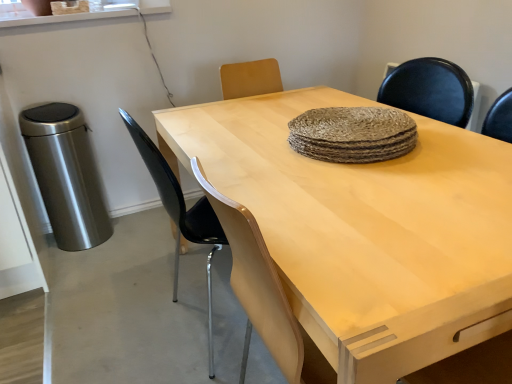
Question: From a real-world perspective, is black plastic chair at center located beneath light wood table at center?

Choices:
 (A) yes
 (B) no

Answer: (B)

Question: Is black plastic chair at center bigger than light wood table at center?

Choices:
 (A) no
 (B) yes

Answer: (A)

Question: Is black plastic chair at center oriented towards light wood table at center?

Choices:
 (A) yes
 (B) no

Answer: (A)

Question: Is black plastic chair at center at the right side of light wood table at center?

Choices:
 (A) no
 (B) yes

Answer: (A)

Question: From a real-world perspective, is black plastic chair at center on light wood table at center?

Choices:
 (A) no
 (B) yes

Answer: (B)

Question: Is light wood table at center a part of black plastic chair at center?

Choices:
 (A) no
 (B) yes

Answer: (A)

Question: Does light wood table at center have a lesser height compared to black plastic chair at center?

Choices:
 (A) yes
 (B) no

Answer: (A)

Question: Considering the relative positions of light wood table at center and black plastic chair at center in the image provided, is light wood table at center to the right of black plastic chair at center from the viewer's perspective?

Choices:
 (A) yes
 (B) no

Answer: (A)

Question: Can you see light wood table at center touching black plastic chair at center?

Choices:
 (A) no
 (B) yes

Answer: (A)

Question: Considering the relative positions of light wood table at center and black plastic chair at center in the image provided, is light wood table at center to the left of black plastic chair at center from the viewer's perspective?

Choices:
 (A) no
 (B) yes

Answer: (A)

Question: From a real-world perspective, is light wood table at center located higher than black plastic chair at center?

Choices:
 (A) no
 (B) yes

Answer: (A)

Question: Could you tell me if light wood table at center is turned towards black plastic chair at center?

Choices:
 (A) yes
 (B) no

Answer: (A)

Question: From a real-world perspective, is light wood table at center positioned above or below black plastic chair at center?

Choices:
 (A) below
 (B) above

Answer: (A)